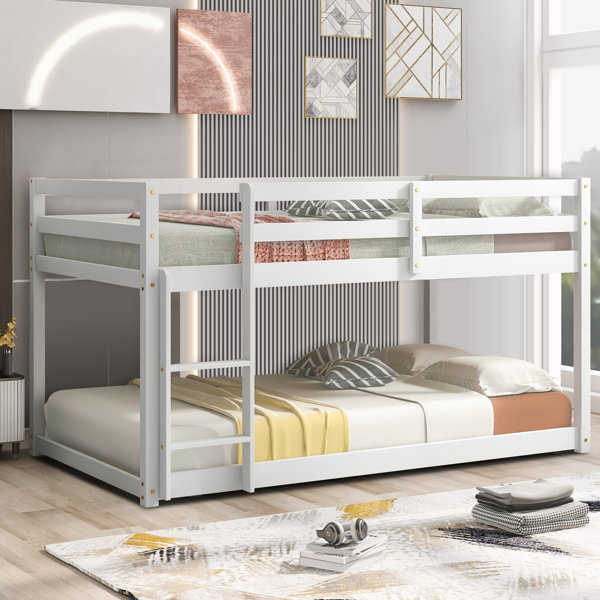
Identify the location of bown floor. (34, 502).